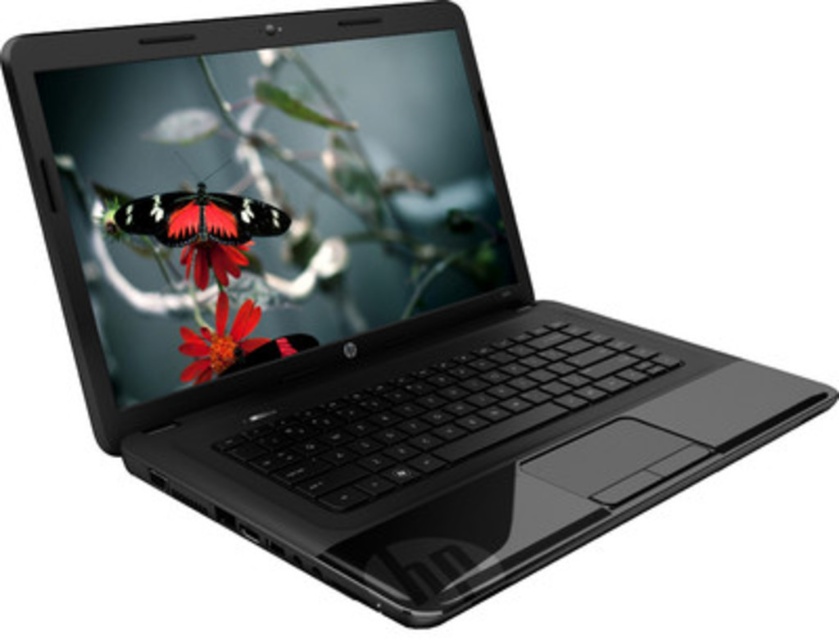
Is matte plastic flower at center taller than red matte flower at center?

Yes.

Does matte plastic flower at center have a smaller size compared to red matte flower at center?

Actually, matte plastic flower at center might be larger than red matte flower at center.

You are a GUI agent. You are given a task and a screenshot of the screen. Output one action in this format:
    pyautogui.click(x=<x>, y=<y>)
    Task: Click on the matte plastic flower at center
    The image size is (839, 640).
    Given the screenshot: What is the action you would take?
    pyautogui.click(x=219, y=340)

Which is in front, point (348, 272) or point (243, 349)?

Positioned in front is point (243, 349).

Is glossy plastic screen at center positioned in front of matte plastic flower at center?

That is True.

Image resolution: width=839 pixels, height=640 pixels. Identify the location of glossy plastic screen at center. (275, 192).

The width and height of the screenshot is (839, 640). In order to click on glossy plastic screen at center in this screenshot , I will do `click(275, 192)`.

Is glossy plastic screen at center positioned behind red matte flower at center?

No, glossy plastic screen at center is closer to the viewer.

At what (x,y) coordinates should I click in order to perform the action: click on glossy plastic screen at center. Please return your answer as a coordinate pair (x, y). Looking at the image, I should click on (275, 192).